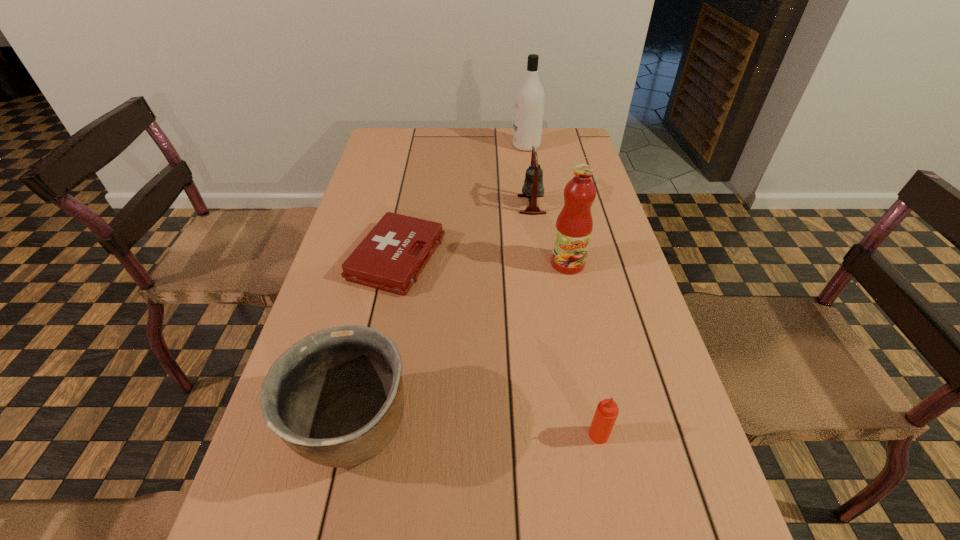
Locate an element on the screen. object located at the far right corner is located at coordinates (530, 98).

Where is `free space at the far edge`? This screenshot has height=540, width=960. free space at the far edge is located at coordinates (540, 156).

Identify the location of vacant space at the right edge of the desktop. Image resolution: width=960 pixels, height=540 pixels. (617, 365).

Locate an element on the screen. free point between the shampoo and the fruit juice is located at coordinates (547, 205).

Image resolution: width=960 pixels, height=540 pixels. I want to click on vacant area that lies between the first-aid kit and the bell, so click(464, 231).

What are the coordinates of `vacant area that lies between the fruit juice and the fifth tallest object` in the screenshot? It's located at (583, 349).

The height and width of the screenshot is (540, 960). I want to click on free space that is in between the second shortest object and the shampoo, so click(x=563, y=291).

Image resolution: width=960 pixels, height=540 pixels. Identify the location of unoccupied position between the pottery and the second farthest object. (442, 316).

Find the location of a particular element. The width and height of the screenshot is (960, 540). vacant region between the bell and the shortest object is located at coordinates (464, 231).

Identify the location of free spot between the fruit juice and the shampoo. Image resolution: width=960 pixels, height=540 pixels. (547, 205).